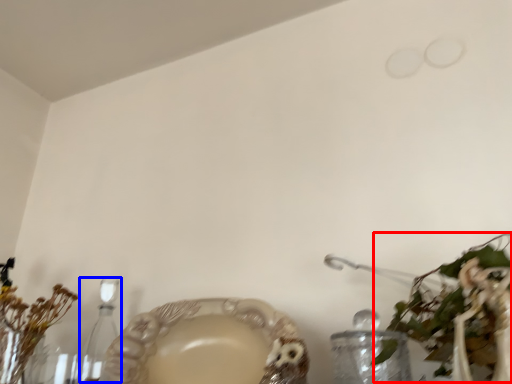
Question: Which point is further to the camera, floral arrangement (highlighted by a red box) or candle holder (highlighted by a blue box)?

Choices:
 (A) floral arrangement
 (B) candle holder

Answer: (B)